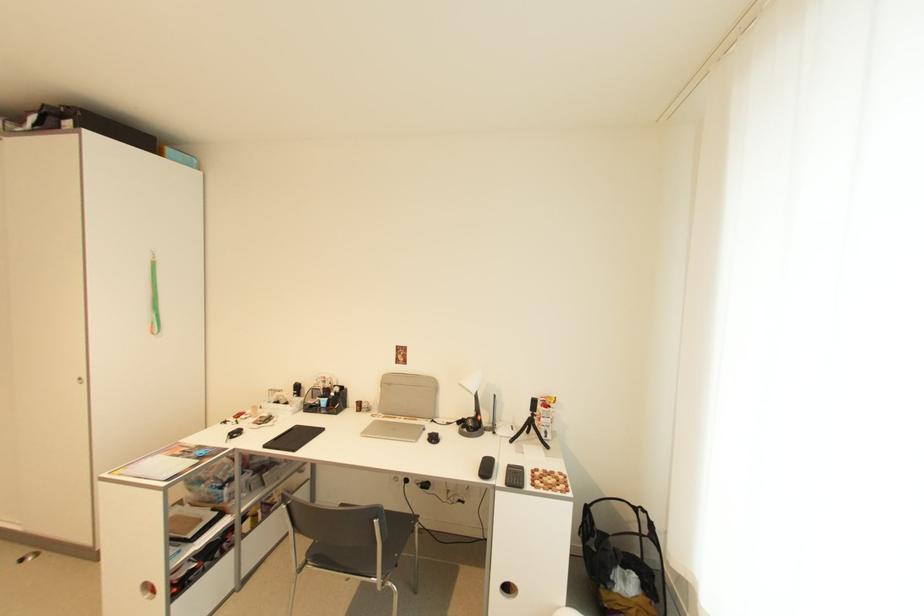
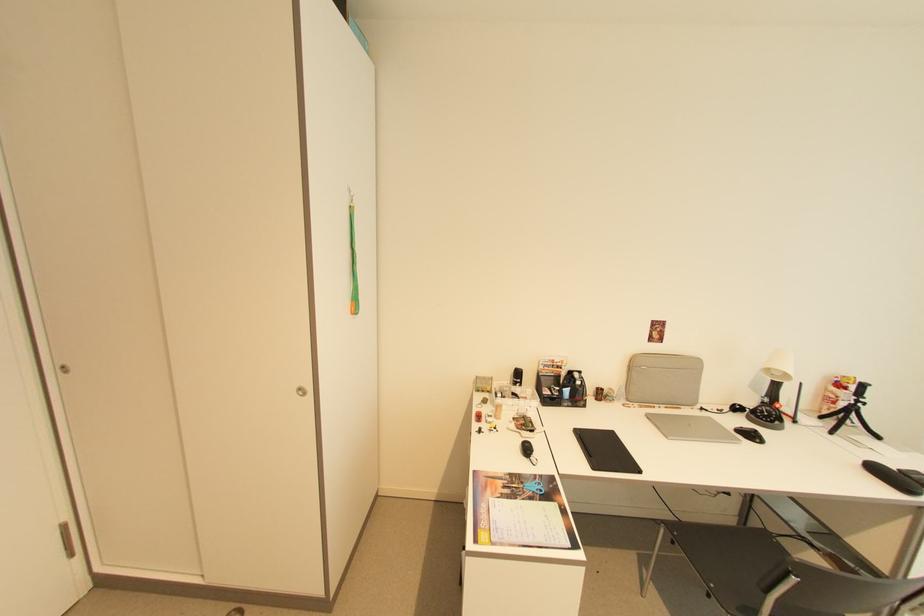
Locate, in the second image, the point that corresponds to point (535, 418) in the first image.

(857, 405)